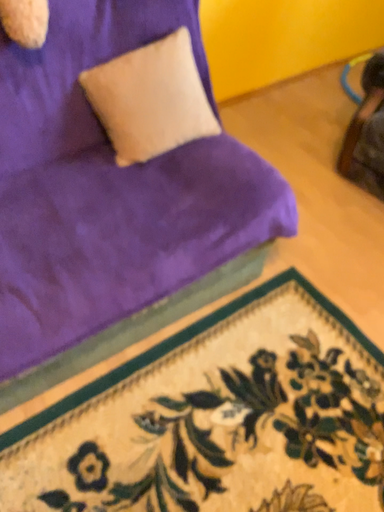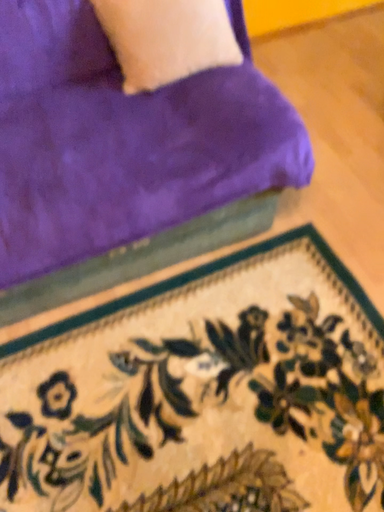
Question: How did the camera likely rotate when shooting the video?

Choices:
 (A) rotated downward
 (B) rotated upward

Answer: (A)